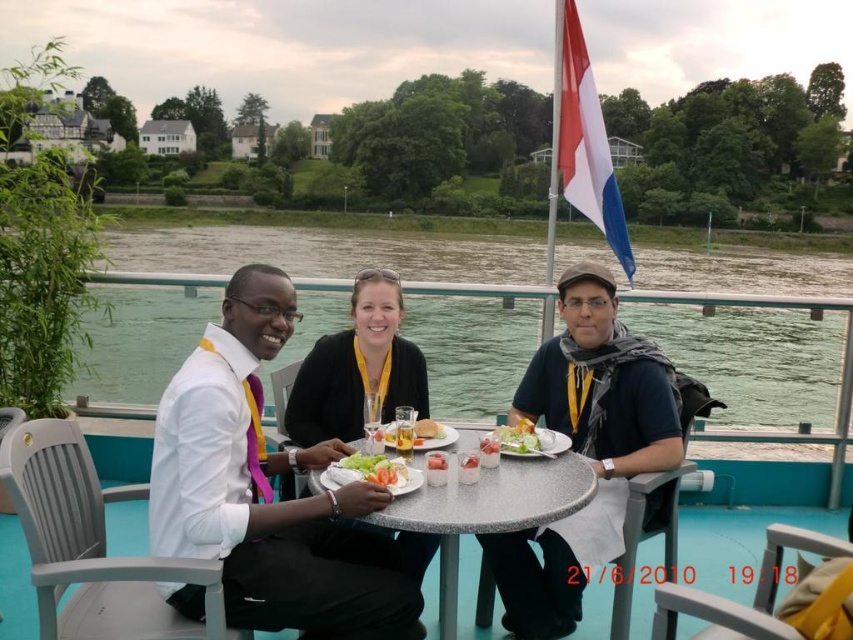
Question: Based on their relative distances, which object is nearer to the translucent glass plate at center?

Choices:
 (A) granite table at center
 (B) white glossy plate at center

Answer: (B)

Question: Which of the following is the farthest from the observer?

Choices:
 (A) (386, 440)
 (B) (421, 579)
 (C) (434, 420)

Answer: (C)

Question: Among these points, which one is farthest from the camera?

Choices:
 (A) (376, 458)
 (B) (250, 493)
 (C) (436, 467)
 (D) (532, 424)

Answer: (D)

Question: Where is greenish-blue water at center located in relation to shiny plastic salad bowl at center in the image?

Choices:
 (A) below
 (B) above

Answer: (B)

Question: Does granite table at center appear over shiny plastic salad bowl at center?

Choices:
 (A) no
 (B) yes

Answer: (A)

Question: Is dark blue shirt at center closer to camera compared to translucent glass plate at center?

Choices:
 (A) yes
 (B) no

Answer: (A)